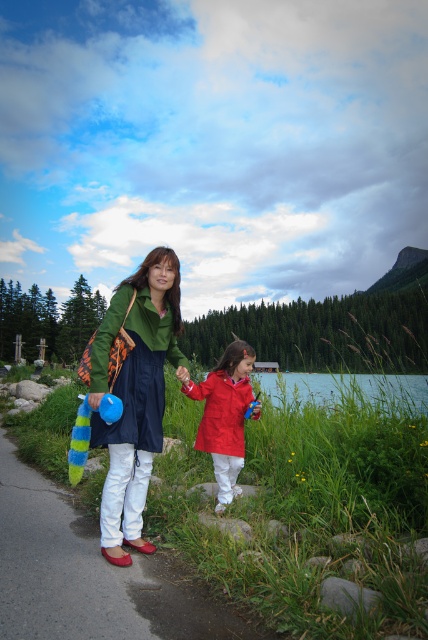
Question: Can you confirm if matte green dress at center is positioned to the right of green grass at lower center?

Choices:
 (A) no
 (B) yes

Answer: (A)

Question: Which point appears farthest from the camera in this image?

Choices:
 (A) (59, 621)
 (B) (241, 422)

Answer: (B)

Question: Among these points, which one is nearest to the camera?

Choices:
 (A) (374, 397)
 (B) (121, 556)
 (C) (115, 600)
 (D) (223, 429)

Answer: (C)

Question: Which object is positioned closest to the matte red jacket at center?

Choices:
 (A) white smooth path at lower left
 (B) green grass at lower center

Answer: (A)

Question: Is matte red jacket at center above green grass at lower center?

Choices:
 (A) no
 (B) yes

Answer: (B)

Question: Is matte red jacket at center smaller than green grass at lower center?

Choices:
 (A) yes
 (B) no

Answer: (A)